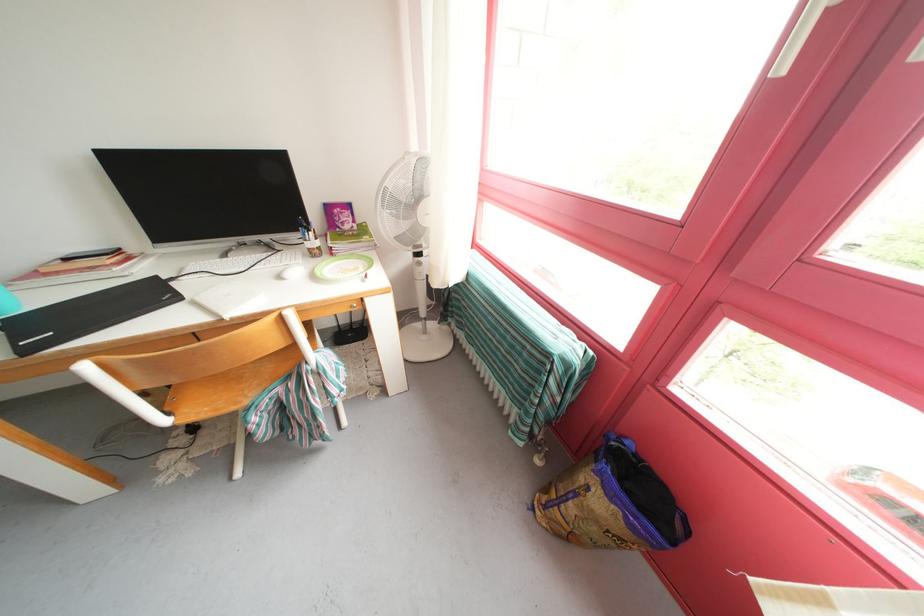
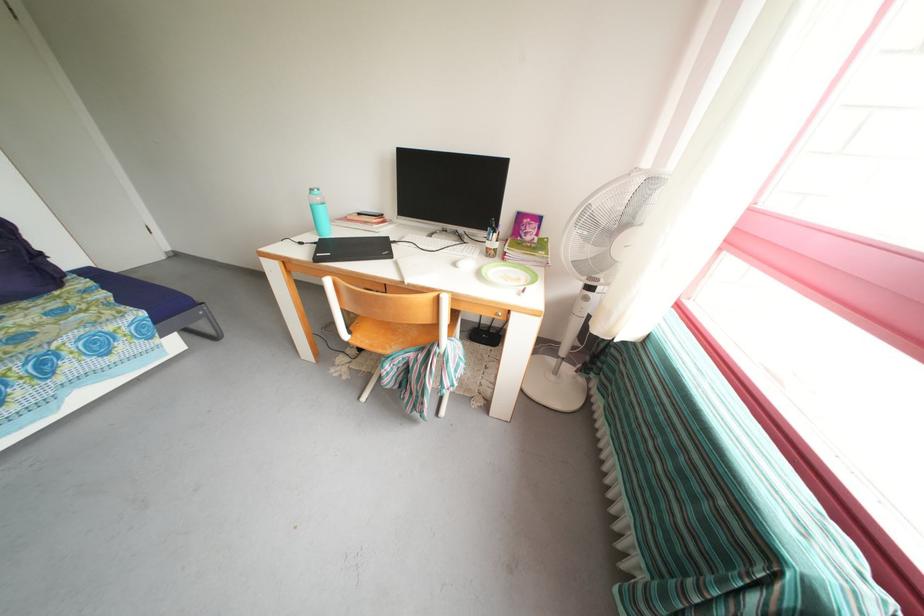
Locate, in the second image, the point that corresponds to pixel 172 427 in the first image.

(353, 342)